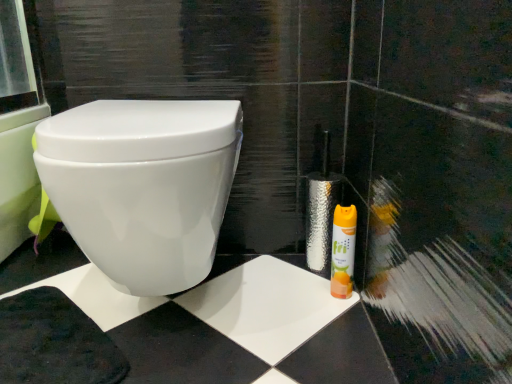
In order to click on free space in front of yellow matte canister at lower right in this screenshot , I will do `click(331, 333)`.